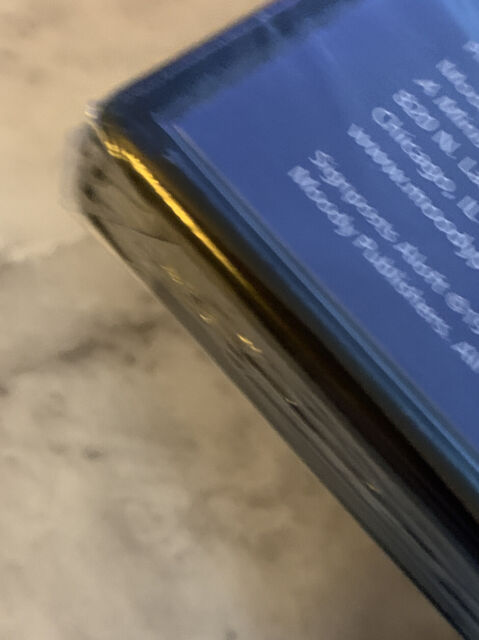
The image size is (479, 640). Identify the location of bottom left rear corner of blue binder. (189, 123).